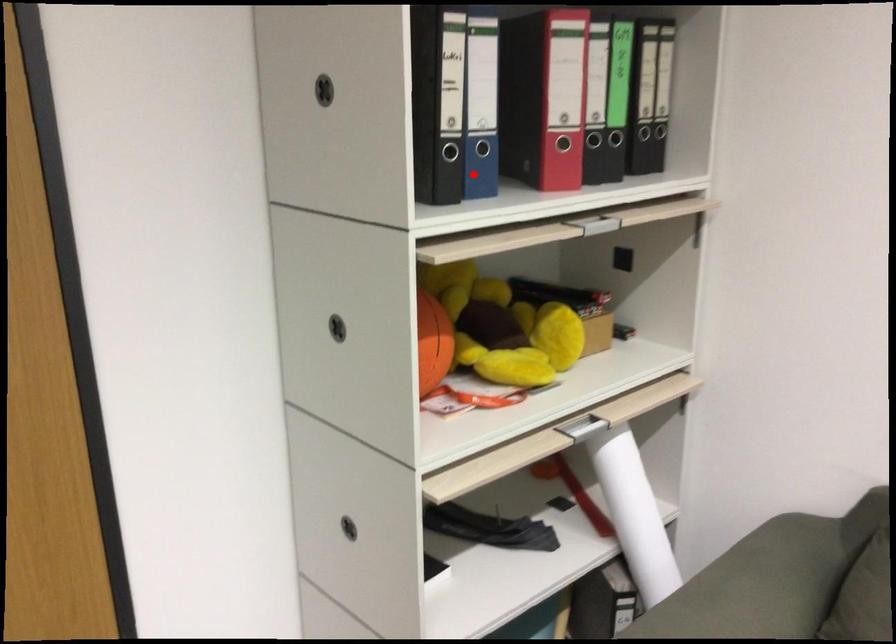
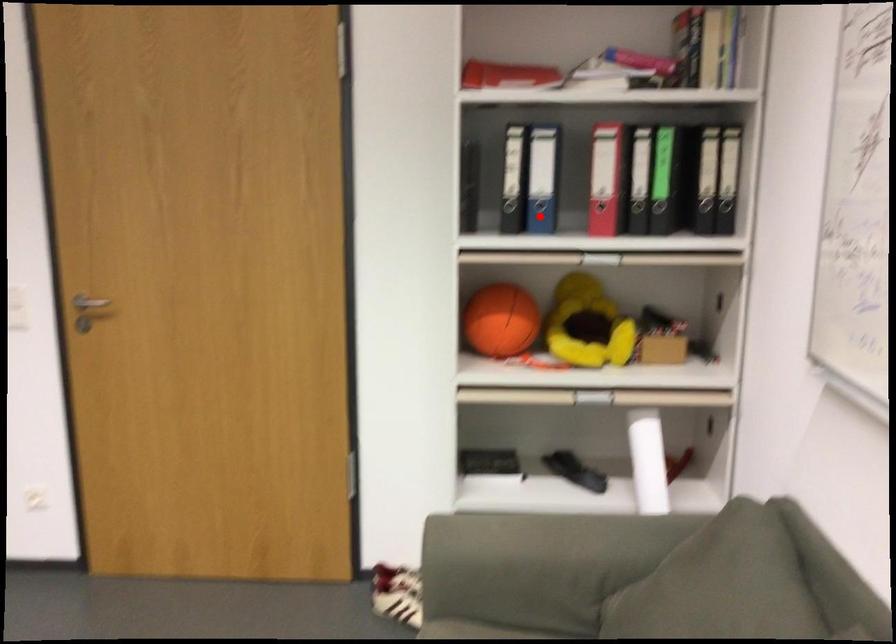
I am providing you with two images of the same scene from different viewpoints. A red point is marked on the first image and another point is marked on the second image. Are the points marked in image1 and image2 representing the same 3D position?

Yes